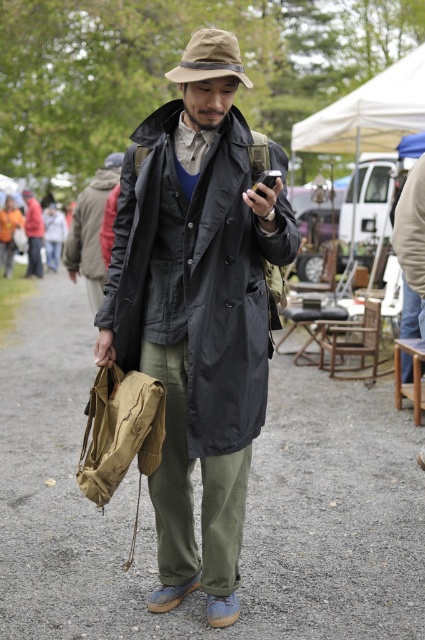
The image size is (425, 640). Find the location of `khaki canvas duffel at lower left`. khaki canvas duffel at lower left is located at coordinates (119, 429).

Between khaki canvas duffel at lower left and white fabric canopy at upper center, which one is positioned lower?

khaki canvas duffel at lower left is lower down.

Who is more distant from viewer, (136, 378) or (300, 128)?

Positioned behind is point (300, 128).

Locate an element on the screen. The image size is (425, 640). khaki canvas duffel at lower left is located at coordinates (119, 429).

Between matte black coat at center and khaki fabric fedora at center, which one is positioned higher?

Positioned higher is khaki fabric fedora at center.

Where is `matte black coat at center`? The image size is (425, 640). matte black coat at center is located at coordinates (198, 276).

The height and width of the screenshot is (640, 425). Find the location of `matte black coat at center`. matte black coat at center is located at coordinates (198, 276).

What do you see at coordinates (198, 276) in the screenshot? This screenshot has width=425, height=640. I see `matte black coat at center` at bounding box center [198, 276].

Is matte black coat at center thinner than brown fabric hat at center?

Correct, matte black coat at center's width is less than brown fabric hat at center's.

Is point (286, 234) closer to viewer compared to point (113, 154)?

Yes, it is.

Locate an element on the screen. This screenshot has width=425, height=640. matte black coat at center is located at coordinates (198, 276).